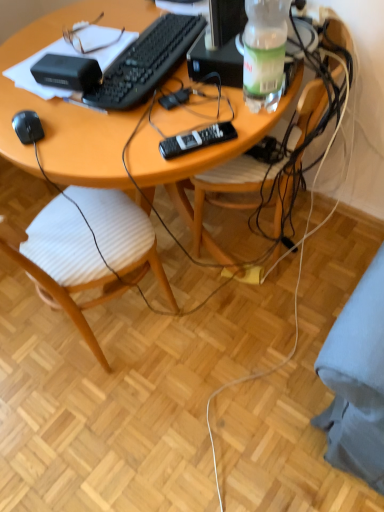
Question: From the image's perspective, is black plastic remote at center located above wooden desk at center?

Choices:
 (A) no
 (B) yes

Answer: (A)

Question: Is black plastic remote at center smaller than wooden desk at center?

Choices:
 (A) yes
 (B) no

Answer: (A)

Question: Can you confirm if black plastic remote at center is bigger than wooden desk at center?

Choices:
 (A) yes
 (B) no

Answer: (B)

Question: From a real-world perspective, is black plastic remote at center on wooden desk at center?

Choices:
 (A) no
 (B) yes

Answer: (B)

Question: Is black plastic remote at center in contact with wooden desk at center?

Choices:
 (A) no
 (B) yes

Answer: (A)

Question: Is black plastic remote at center shorter than wooden desk at center?

Choices:
 (A) no
 (B) yes

Answer: (B)

Question: Is wooden desk at center turned away from black matte computer mouse at lower left?

Choices:
 (A) no
 (B) yes

Answer: (A)

Question: Does wooden desk at center have a greater width compared to black matte computer mouse at lower left?

Choices:
 (A) yes
 (B) no

Answer: (A)

Question: Is wooden desk at center further to camera compared to black matte computer mouse at lower left?

Choices:
 (A) yes
 (B) no

Answer: (B)

Question: Considering the relative sizes of wooden desk at center and black matte computer mouse at lower left in the image provided, is wooden desk at center shorter than black matte computer mouse at lower left?

Choices:
 (A) yes
 (B) no

Answer: (B)

Question: Is wooden desk at center outside black matte computer mouse at lower left?

Choices:
 (A) yes
 (B) no

Answer: (A)

Question: From the image's perspective, does wooden desk at center appear higher than black matte computer mouse at lower left?

Choices:
 (A) no
 (B) yes

Answer: (B)

Question: Is wooden chair at center, which is counted as the second chair, starting from the right, closer to the viewer compared to wooden desk at center?

Choices:
 (A) no
 (B) yes

Answer: (B)